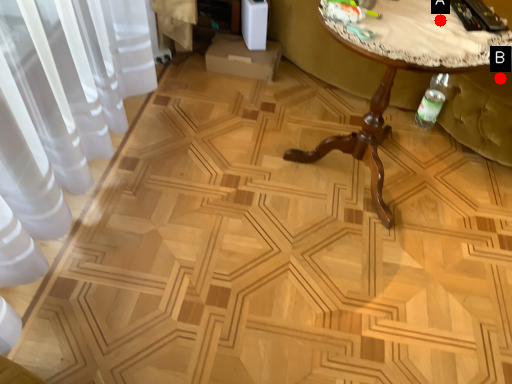
Question: Two points are circled on the image, labeled by A and B beside each circle. Which of the following is the closest to the observer?

Choices:
 (A) A is closer
 (B) B is closer

Answer: (A)